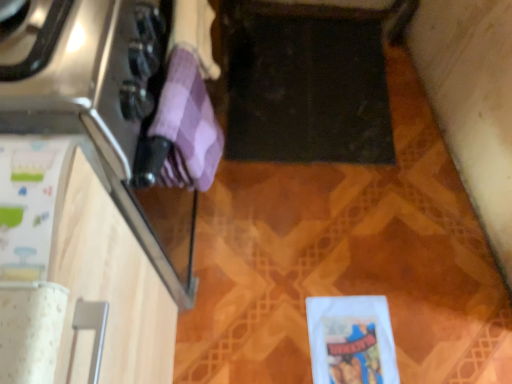
Question: In the image, is white matte wrapping paper at lower right, which is the 3th wrapping paper from top to bottom, positioned in front of or behind white paper at left, which appears as the 2th wrapping paper when ordered from the bottom?

Choices:
 (A) behind
 (B) front

Answer: (A)

Question: Considering the positions of white matte wrapping paper at lower right, placed as the first wrapping paper when sorted from right to left, and white paper at left, marked as the 1th wrapping paper in a left-to-right arrangement, in the image, is white matte wrapping paper at lower right, placed as the first wrapping paper when sorted from right to left, wider or thinner than white paper at left, marked as the 1th wrapping paper in a left-to-right arrangement,?

Choices:
 (A) thin
 (B) wide

Answer: (A)

Question: Estimate the real-world distances between objects in this image. Which object is closer to the white matte wrapping paper at lower right, the 3th wrapping paper from the left?

Choices:
 (A) purple checkered towel at left, the 2th wrapping paper positioned from the front
 (B) white paper at left, which appears as the 2th wrapping paper when ordered from the bottom

Answer: (A)

Question: Estimate the real-world distances between objects in this image. Which object is farther from the purple checkered towel at left, which is the second wrapping paper from back to front?

Choices:
 (A) white matte wrapping paper at lower right, which is the 3th wrapping paper from top to bottom
 (B) white paper at left, which appears as the 2th wrapping paper when ordered from the bottom

Answer: (A)